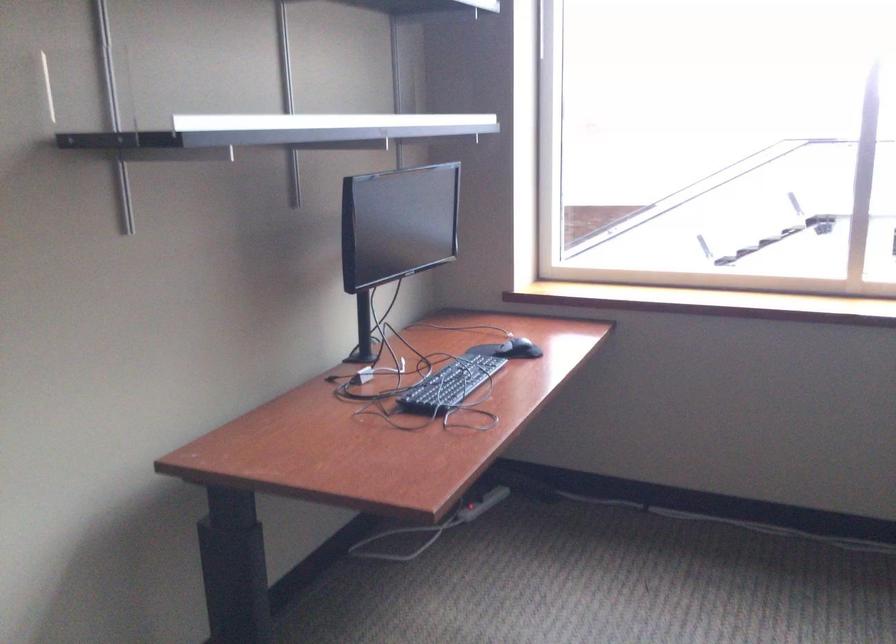
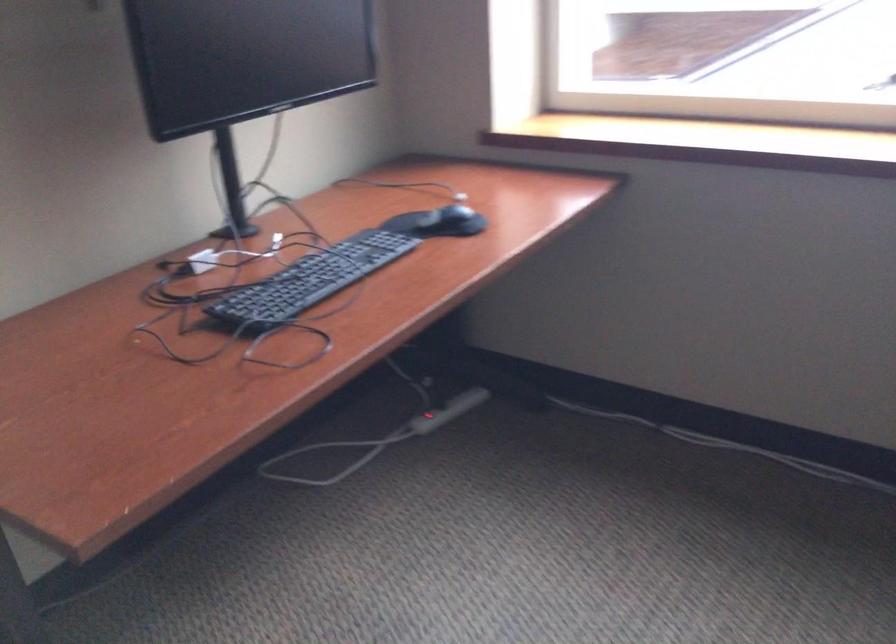
Locate, in the second image, the point that corresponds to point 474,512 in the first image.

(428, 421)